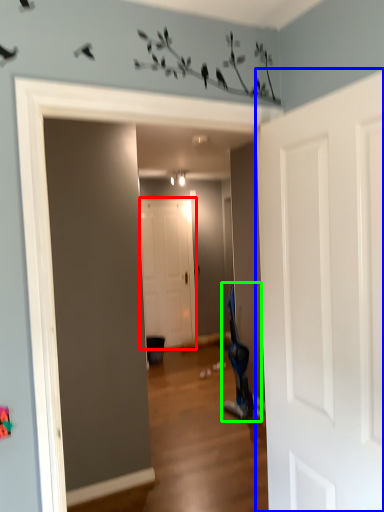
Question: Estimate the real-world distances between objects in this image. Which object is closer to door (highlighted by a red box), door (highlighted by a blue box) or swivel chair (highlighted by a green box)?

Choices:
 (A) door
 (B) swivel chair

Answer: (B)